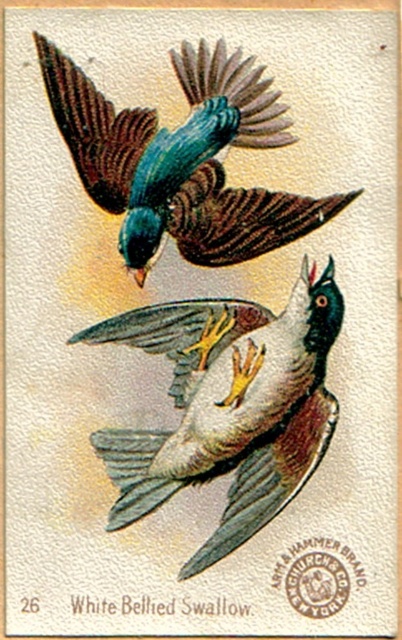
You are an ornithologist studying the White Bellied Swallow. You notice a specific point in the image at coordinates (227, 404). Based on the scene, which bird does this point correspond to?

The point at (227, 404) marks the white feathered bird at center.